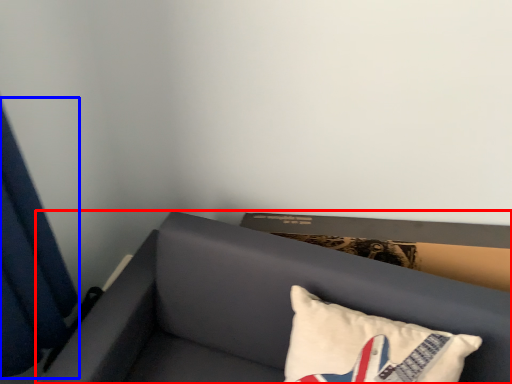
Question: Which point is closer to the camera, furniture (highlighted by a red box) or curtain (highlighted by a blue box)?

Choices:
 (A) furniture
 (B) curtain

Answer: (B)